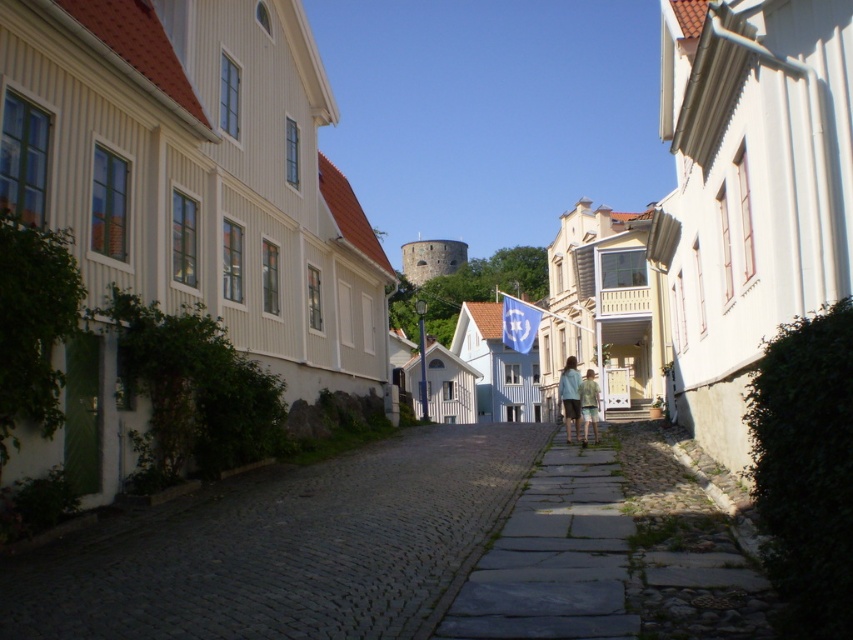
Is blue denim shorts at center positioned at the back of green cotton shorts at center?

Yes, blue denim shorts at center is behind green cotton shorts at center.

Is blue denim shorts at center below green cotton shorts at center?

Correct, blue denim shorts at center is located below green cotton shorts at center.

Does point (575, 369) lie behind point (583, 387)?

Yes, point (575, 369) is farther from viewer.

This screenshot has width=853, height=640. Identify the location of blue denim shorts at center. [x=570, y=396].

Does gray stone path at center lie behind green cotton shorts at center?

No.

Between point (604, 456) and point (595, 392), which one is positioned behind?

The point (595, 392) is more distant.

At what (x,y) coordinates should I click in order to perform the action: click on gray stone path at center. Please return your answer as a coordinate pair (x, y). Looking at the image, I should click on (553, 557).

Based on the photo, is gray stone path at center further to camera compared to blue denim shorts at center?

No.

Is gray stone path at center above blue denim shorts at center?

Actually, gray stone path at center is below blue denim shorts at center.

At what (x,y) coordinates should I click in order to perform the action: click on gray stone path at center. Please return your answer as a coordinate pair (x, y). Looking at the image, I should click on (553, 557).